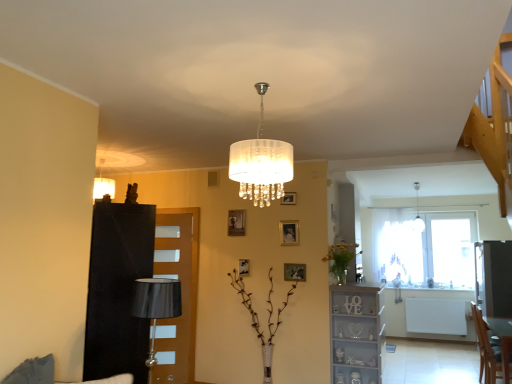
Question: Is matte gold picture frame at center, which ranks as the third picture frame in top-to-bottom order, inside the boundaries of white wood shelf at lower right, or outside?

Choices:
 (A) outside
 (B) inside

Answer: (A)

Question: Considering the positions of matte gold picture frame at center, which ranks as the third picture frame in top-to-bottom order, and white wood shelf at lower right in the image, is matte gold picture frame at center, which ranks as the third picture frame in top-to-bottom order, bigger or smaller than white wood shelf at lower right?

Choices:
 (A) big
 (B) small

Answer: (B)

Question: Which of these objects is positioned farthest from the white wood shelf at lower right?

Choices:
 (A) translucent glass vase at center, which is the second plant in left-to-right order
 (B) black leather dresser at left
 (C) gold metallic picture frame at center, acting as the 1th picture frame starting from the bottom
 (D) white glass pendant light at upper right, arranged as the 1th lamp when viewed from the back
 (E) brown textured plant at center, the 2th plant positioned from the right

Answer: (D)

Question: Based on their relative distances, which object is nearer to the translucent glass vase at center, which is the second plant in left-to-right order?

Choices:
 (A) transparent glass window at upper right
 (B) white wood shelf at lower right
 (C) metallic gold picture frame at center, the 2th picture frame in the left-to-right sequence
 (D) gold metallic picture frame at upper center, the 3th picture frame viewed from the right
 (E) matte gold picture frame at center, which ranks as the third picture frame in top-to-bottom order

Answer: (B)